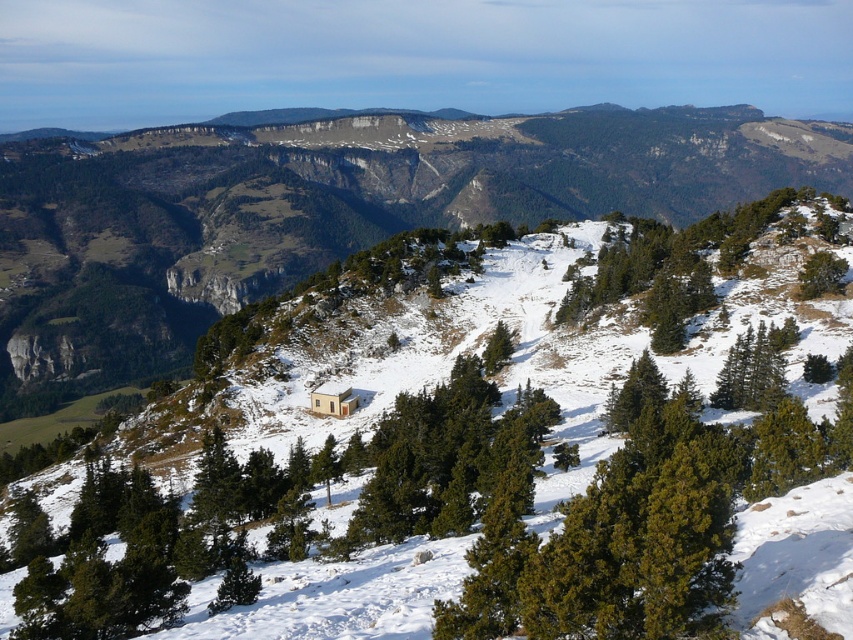
You are standing at the base of the mountain and see the green matte tree at center and the light brown wooden hut at center. Which object is positioned to the right of the other?

The green matte tree at center is to the right of the light brown wooden hut at center.

You are an explorer standing at the edge of the valley looking towards the center of the image. You see the green matte tree at center and the light brown wooden hut at center. Which object is closer to you?

The green matte tree at center is closer to you because it is in front of the light brown wooden hut at center.

You are planning to build a small shed near the light brown wooden hut at center. Considering the green matte tree at center is larger than the hut, would the tree provide sufficient shade for the shed during the afternoon?

The green matte tree at center has a larger size compared to the light brown wooden hut at center, so yes, it would provide sufficient shade for the shed during the afternoon.